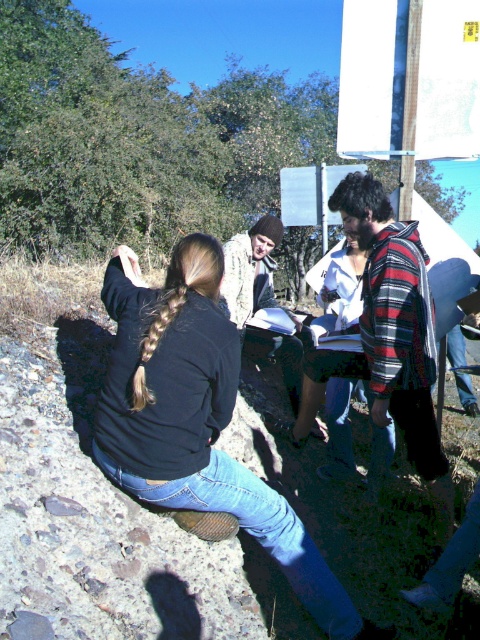
Question: Which point is farther from the camera taking this photo?

Choices:
 (A) (244, 241)
 (B) (380, 269)
 (C) (191, 378)

Answer: (A)

Question: Can you confirm if black matte jacket at lower left is positioned below camouflage-patterned jacket at center?

Choices:
 (A) no
 (B) yes

Answer: (B)

Question: Which of the following is the farthest from the observer?

Choices:
 (A) (374, 321)
 (B) (256, 275)

Answer: (B)

Question: Is black matte jacket at lower left below flannel shirt at center?

Choices:
 (A) yes
 (B) no

Answer: (A)

Question: Estimate the real-world distances between objects in this image. Which object is closer to the black matte jacket at lower left?

Choices:
 (A) flannel shirt at center
 (B) camouflage-patterned jacket at center

Answer: (A)

Question: From the image, what is the correct spatial relationship of flannel shirt at center in relation to camouflage-patterned jacket at center?

Choices:
 (A) left
 (B) right

Answer: (B)